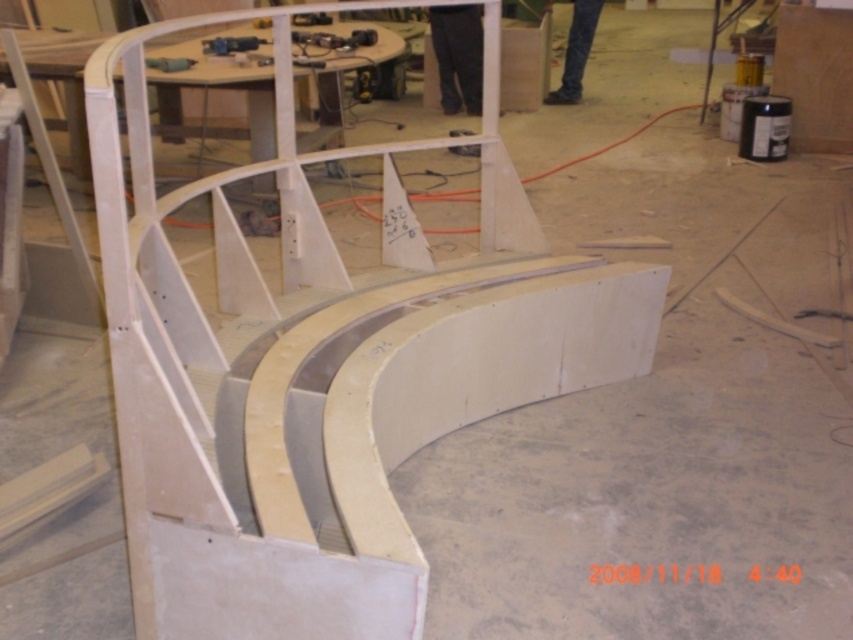
Question: Is dark gray pants at center closer to the viewer compared to metallic gray drill at upper center?

Choices:
 (A) yes
 (B) no

Answer: (B)

Question: Can you confirm if dark gray pants at center is positioned below metallic blue drill at upper center?

Choices:
 (A) no
 (B) yes

Answer: (A)

Question: Which of the following is the farthest from the observer?

Choices:
 (A) metallic blue drill at upper center
 (B) metallic gray drill at upper center
 (C) blue jeans at center
 (D) dark gray pants at center

Answer: (C)

Question: Is dark gray pants at center bigger than blue jeans at center?

Choices:
 (A) yes
 (B) no

Answer: (A)

Question: Which point is closer to the camera?

Choices:
 (A) metallic blue drill at upper center
 (B) blue jeans at center
 (C) metallic gray drill at upper center

Answer: (C)

Question: Which point is closer to the camera?

Choices:
 (A) dark gray pants at center
 (B) metallic gray drill at upper center
 (C) blue jeans at center

Answer: (B)